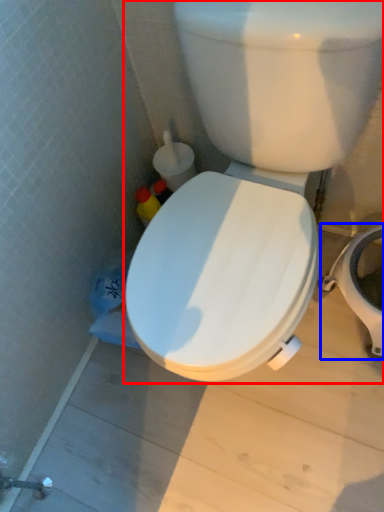
Question: Which object is closer to the camera taking this photo, toilet (highlighted by a red box) or bidet (highlighted by a blue box)?

Choices:
 (A) toilet
 (B) bidet

Answer: (A)